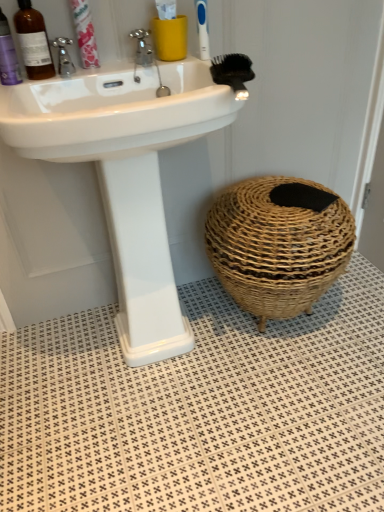
At what (x,y) coordinates should I click in order to perform the action: click on free point above white textured tile at lower center (from a real-world perspective). Please return your answer as a coordinate pair (x, y). Looking at the image, I should click on (208, 376).